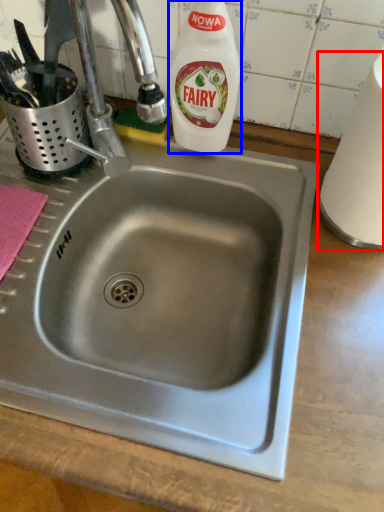
Question: Which object is further to the camera taking this photo, paper towel (highlighted by a red box) or cleaning product (highlighted by a blue box)?

Choices:
 (A) paper towel
 (B) cleaning product

Answer: (B)